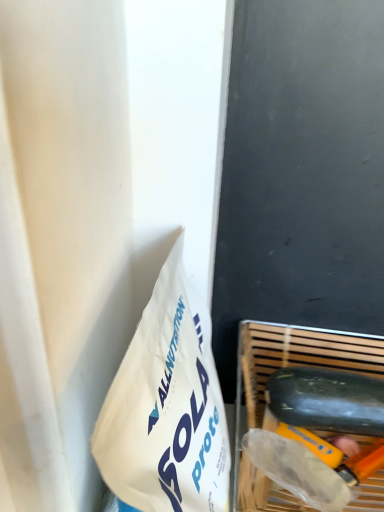
Question: Should I look upward or downward to see smooth black cucumber at lower right?

Choices:
 (A) up
 (B) down

Answer: (B)

Question: From a real-world perspective, is smooth black cucumber at lower right located higher than wooden slatted basket at lower right?

Choices:
 (A) no
 (B) yes

Answer: (B)

Question: Is wooden slatted basket at lower right surrounded by smooth black cucumber at lower right?

Choices:
 (A) no
 (B) yes

Answer: (A)

Question: From a real-world perspective, is smooth black cucumber at lower right beneath wooden slatted basket at lower right?

Choices:
 (A) no
 (B) yes

Answer: (A)

Question: Does smooth black cucumber at lower right have a lesser height compared to wooden slatted basket at lower right?

Choices:
 (A) no
 (B) yes

Answer: (B)

Question: From the image's perspective, does smooth black cucumber at lower right appear higher than wooden slatted basket at lower right?

Choices:
 (A) no
 (B) yes

Answer: (B)

Question: Is smooth black cucumber at lower right positioned behind wooden slatted basket at lower right?

Choices:
 (A) no
 (B) yes

Answer: (B)

Question: From the image's perspective, is wooden slatted basket at lower right located beneath smooth black cucumber at lower right?

Choices:
 (A) no
 (B) yes

Answer: (B)

Question: Considering the relative sizes of wooden slatted basket at lower right and smooth black cucumber at lower right in the image provided, is wooden slatted basket at lower right smaller than smooth black cucumber at lower right?

Choices:
 (A) yes
 (B) no

Answer: (B)

Question: Would you say wooden slatted basket at lower right is outside smooth black cucumber at lower right?

Choices:
 (A) yes
 (B) no

Answer: (A)

Question: From the image's perspective, would you say wooden slatted basket at lower right is positioned over smooth black cucumber at lower right?

Choices:
 (A) no
 (B) yes

Answer: (A)

Question: Does wooden slatted basket at lower right contain smooth black cucumber at lower right?

Choices:
 (A) yes
 (B) no

Answer: (A)

Question: From a real-world perspective, is wooden slatted basket at lower right physically above smooth black cucumber at lower right?

Choices:
 (A) yes
 (B) no

Answer: (B)

Question: Considering the positions of point (365, 408) and point (360, 348), is point (365, 408) closer or farther from the camera than point (360, 348)?

Choices:
 (A) farther
 (B) closer

Answer: (B)